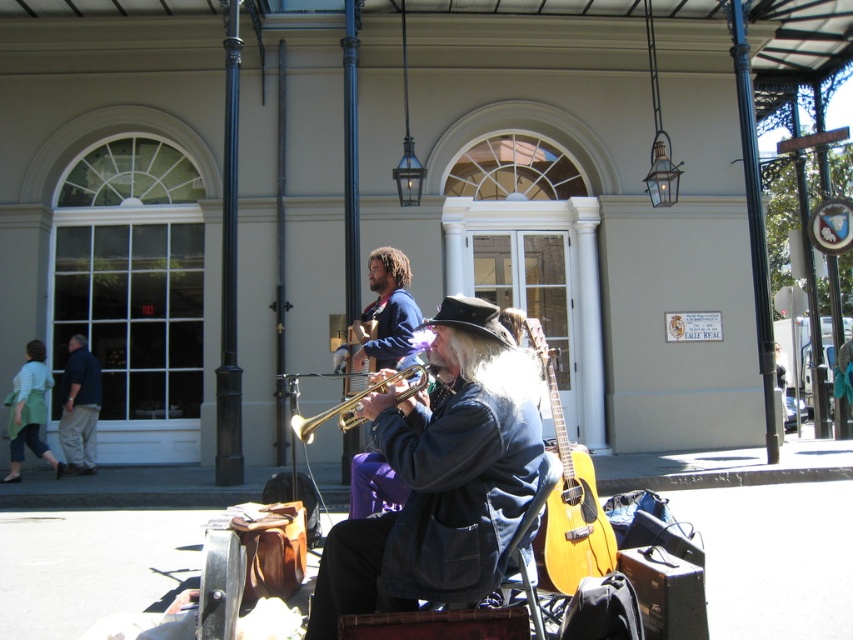
You are a photographer standing in front of the musicians. You want to take a photo that includes both the purple fabric pants at center and the gold shiny trumpet at center. What is the minimum distance you need to move backward to ensure both are fully visible in your camera frame?

The purple fabric pants at center and gold shiny trumpet at center are 2.11 meters apart from each other. To capture both in the frame, you need to move backward until the camera can encompass this distance within its field of view. The exact distance depends on the camera lens and sensor size, but generally, increasing the distance from the subjects will widen the field of view, allowing both objects to fit.

Consider the image. You are a photographer trying to capture the musician playing the gold shiny trumpet at center. The purple fabric pants at center are blocking your view. Can you move the pants to the side to get a clear shot of the trumpet?

The purple fabric pants at center is located above the gold shiny trumpet at center, so you can move the pants downward to get a clear shot of the trumpet.

You are a photographer trying to capture a shot of the dark blue shirt at left and the gold shiny trumpet at center. Which object should you focus on first if you want to include both in your frame?

The dark blue shirt at left is positioned on the left side of gold shiny trumpet at center, so you should focus on the gold shiny trumpet at center first to ensure both are in frame.